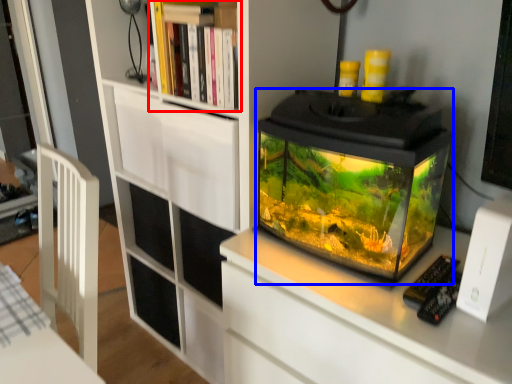
Question: Which of the following is the farthest to the observer, shelf (highlighted by a red box) or glass box (highlighted by a blue box)?

Choices:
 (A) shelf
 (B) glass box

Answer: (A)